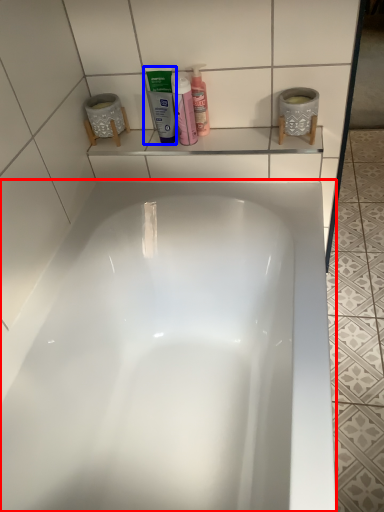
Question: Which object is closer to the camera taking this photo, bathtub (highlighted by a red box) or mouthwash (highlighted by a blue box)?

Choices:
 (A) bathtub
 (B) mouthwash

Answer: (A)